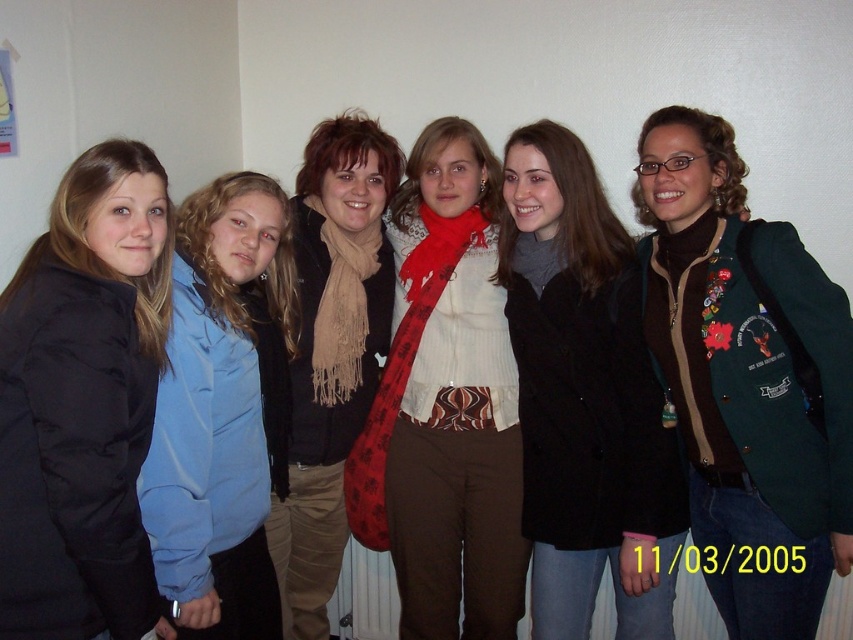
You are a photographer adjusting the camera settings to capture a clear photo of the matte black coat at center and the black puffy jacket at left. The camera has a depth of field that can focus on objects within a 3 feet range. Will both items remain in focus?

The matte black coat at center is 3.29 feet away from the black puffy jacket at left. Since the distance between them exceeds the camera s 3 feet depth of field range, the two items will not both be in focus simultaneously.

You are organizing a clothing donation drive and need to determine which item takes up more space when folded. Based on the scene, which item between the blue fabric shirt at left and the red plaid scarf at center would require more space?

The red plaid scarf at center has a greater width than the blue fabric shirt at left, so it would require more space when folded.